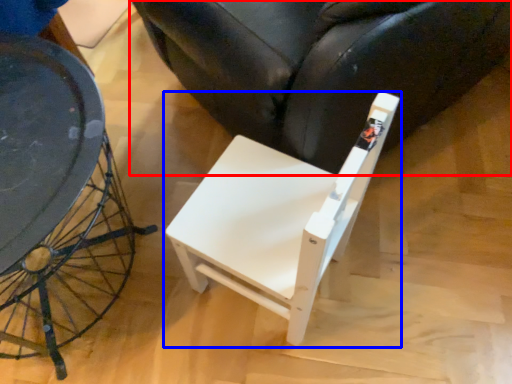
Question: Which object appears farthest to the camera in this image, chair (highlighted by a red box) or chair (highlighted by a blue box)?

Choices:
 (A) chair
 (B) chair

Answer: (A)